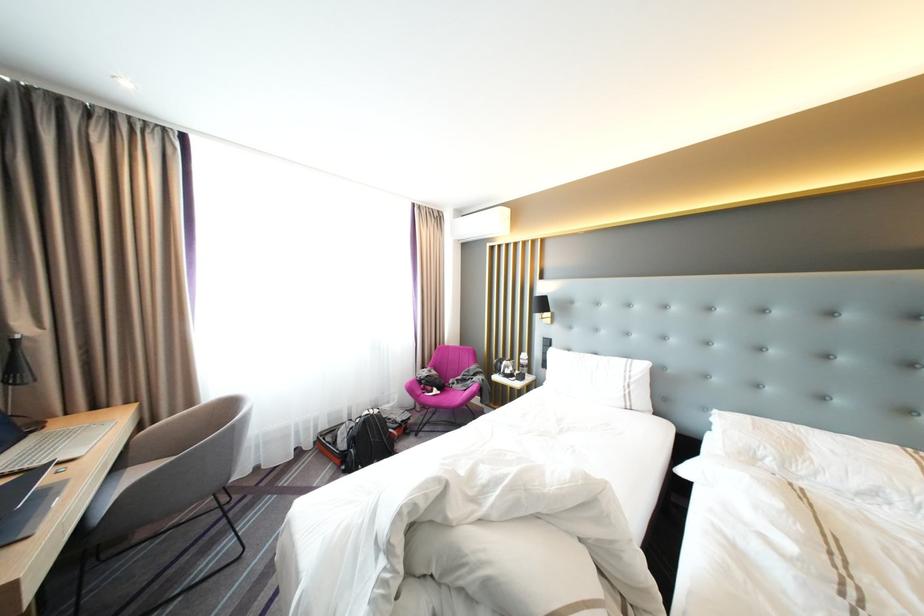
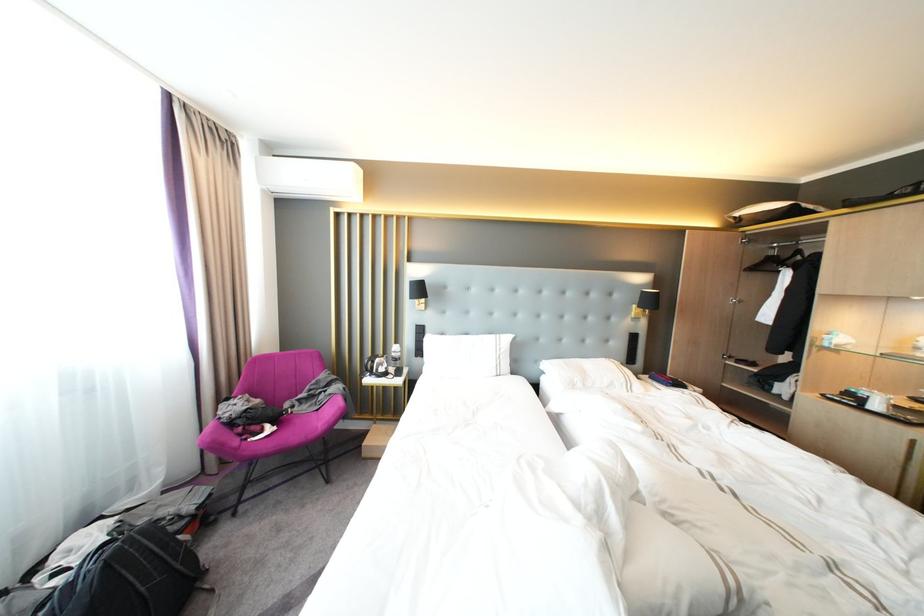
In the second image, find the point that corresponds to the point at 580,351 in the first image.

(455, 334)